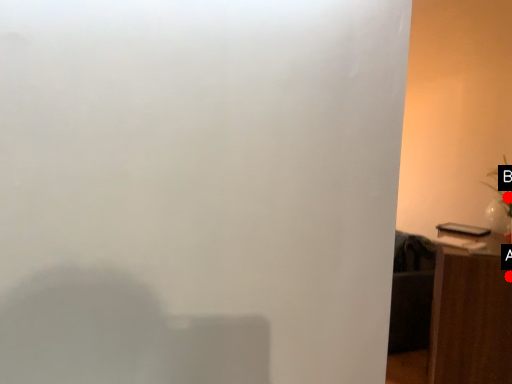
Question: Two points are circled on the image, labeled by A and B beside each circle. Which of the following is the farthest from the observer?

Choices:
 (A) A is further
 (B) B is further

Answer: (B)